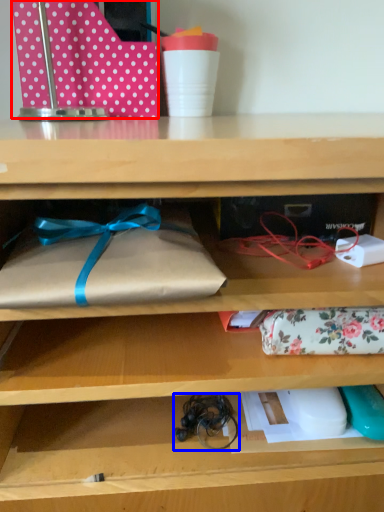
Question: Which of the following is the farthest to the observer, wrapping paper (highlighted by a red box) or twine (highlighted by a blue box)?

Choices:
 (A) wrapping paper
 (B) twine

Answer: (A)